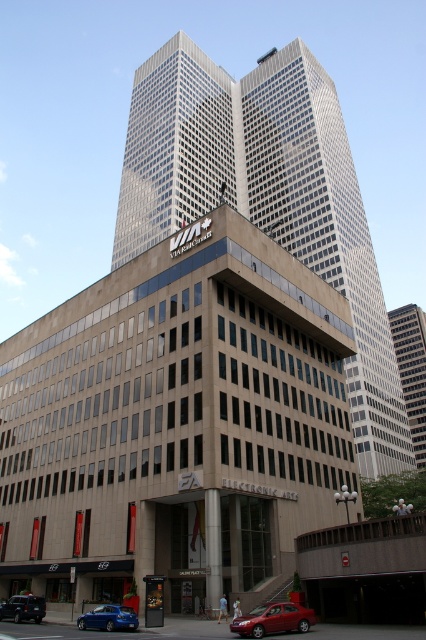
Question: Is glassy reflective skyscraper at center to the left of metallic blue hatchback at lower left from the viewer's perspective?

Choices:
 (A) no
 (B) yes

Answer: (A)

Question: Can you confirm if glassy reflective skyscraper at center is positioned above shiny red sedan at lower center?

Choices:
 (A) yes
 (B) no

Answer: (A)

Question: Which object is closer to the camera taking this photo?

Choices:
 (A) glassy reflective skyscraper at center
 (B) shiny red sedan at lower center

Answer: (B)

Question: Among these objects, which one is farthest from the camera?

Choices:
 (A) glassy reflective skyscraper at center
 (B) metallic blue sedan at lower left
 (C) shiny red sedan at lower center
 (D) metallic blue hatchback at lower left

Answer: (A)

Question: Considering the real-world distances, which object is closest to the shiny red sedan at lower center?

Choices:
 (A) metallic blue sedan at lower left
 (B) glassy steel skyscraper at center

Answer: (A)

Question: Does glassy reflective skyscraper at center appear on the right side of metallic blue hatchback at lower left?

Choices:
 (A) no
 (B) yes

Answer: (B)